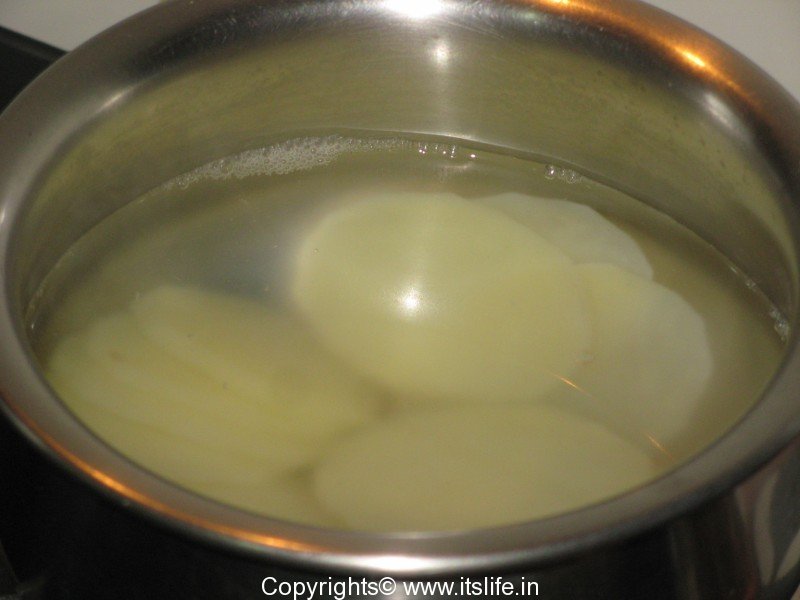
You are a GUI agent. You are given a task and a screenshot of the screen. Output one action in this format:
    pyautogui.click(x=<x>, y=<y>)
    Task: Click on the bowl
    Image resolution: width=800 pixels, height=600 pixels.
    Given the screenshot: What is the action you would take?
    pyautogui.click(x=549, y=114)